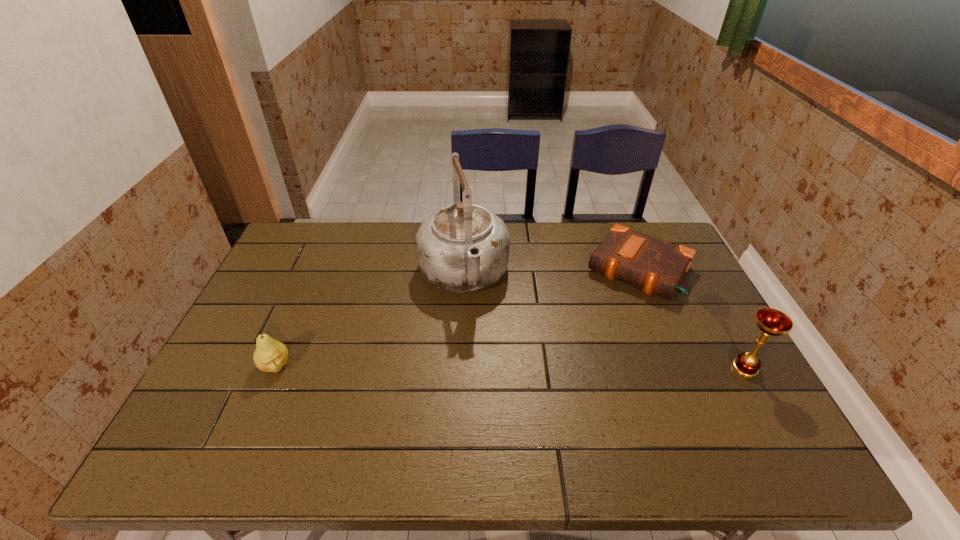
Where is `the second shortest object`? Image resolution: width=960 pixels, height=540 pixels. the second shortest object is located at coordinates (270, 355).

I want to click on the leftmost object, so 270,355.

You are a GUI agent. You are given a task and a screenshot of the screen. Output one action in this format:
    pyautogui.click(x=<x>, y=<y>)
    Task: Click on the second tallest object
    The width and height of the screenshot is (960, 540).
    Given the screenshot: What is the action you would take?
    pyautogui.click(x=770, y=321)

Where is `the tallest object`? The image size is (960, 540). the tallest object is located at coordinates (462, 248).

This screenshot has height=540, width=960. I want to click on kettle, so (x=462, y=248).

Where is `Bible`? Bible is located at coordinates (656, 266).

This screenshot has height=540, width=960. What are the coordinates of `vacant region located on the left of the third tallest object` in the screenshot? It's located at (240, 366).

This screenshot has width=960, height=540. Find the location of `vacant area located on the back of the second tallest object`. vacant area located on the back of the second tallest object is located at coordinates click(x=726, y=333).

At what (x,y) coordinates should I click in order to perform the action: click on vacant space situated 0.290m at the spout of the kettle. Please return your answer as a coordinate pair (x, y). This screenshot has height=540, width=960. Looking at the image, I should click on (493, 400).

Identify the location of free point located 0.110m at the spout of the kettle. The width and height of the screenshot is (960, 540). (479, 343).